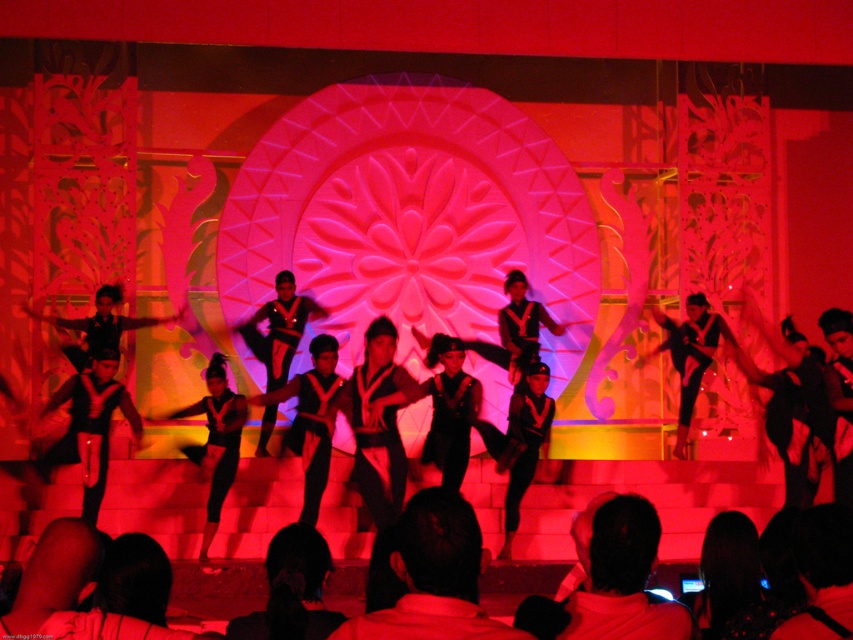
Question: Which object appears farthest from the camera in this image?

Choices:
 (A) black matte leggings at center
 (B) black fabric pants at center

Answer: (A)

Question: Can you confirm if black fabric pants at center is smaller than black matte leggings at center?

Choices:
 (A) yes
 (B) no

Answer: (A)

Question: Which point appears farthest from the camera in this image?

Choices:
 (A) (640, 545)
 (B) (466, 595)

Answer: (A)

Question: Does black fabric pants at center appear under black matte leggings at center?

Choices:
 (A) yes
 (B) no

Answer: (A)

Question: Can you confirm if black fabric shirt at center is smaller than black matte leggings at center?

Choices:
 (A) yes
 (B) no

Answer: (A)

Question: Among these points, which one is farthest from the camera?

Choices:
 (A) (212, 515)
 (B) (627, 538)

Answer: (A)